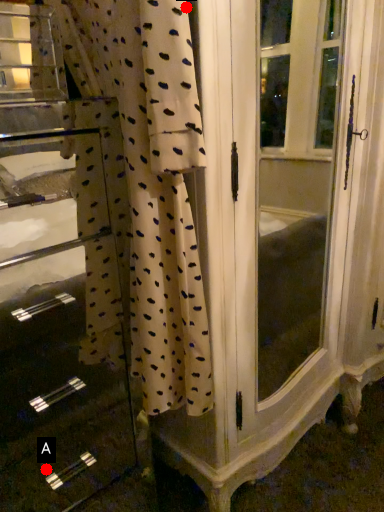
Question: Two points are circled on the image, labeled by A and B beside each circle. Which point appears closest to the camera in this image?

Choices:
 (A) A is closer
 (B) B is closer

Answer: (B)